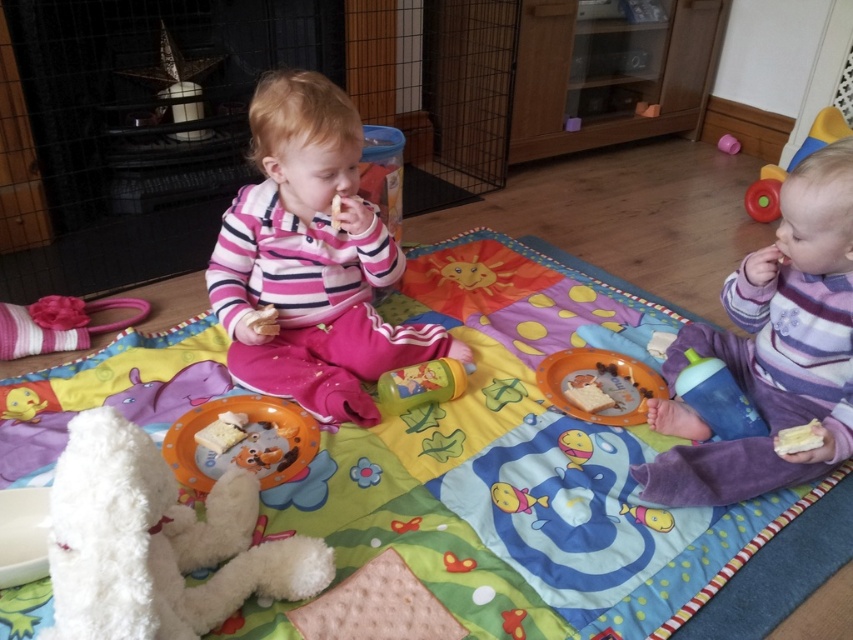
Does rubberized red ball at upper right have a greater width compared to matte pink cup at upper right?

Yes, rubberized red ball at upper right is wider than matte pink cup at upper right.

Is point (758, 180) positioned behind point (718, 138)?

That is False.

This screenshot has width=853, height=640. I want to click on rubberized red ball at upper right, so (x=792, y=164).

Is the position of pink fleece sweater at center more distant than that of translucent plastic sippy cup at center?

No, pink fleece sweater at center is in front of translucent plastic sippy cup at center.

Between point (283, 339) and point (448, 392), which one is positioned behind?

The point (283, 339) is more distant.

Image resolution: width=853 pixels, height=640 pixels. What do you see at coordinates (311, 259) in the screenshot?
I see `pink fleece sweater at center` at bounding box center [311, 259].

I want to click on pink fleece sweater at center, so click(x=311, y=259).

Which is below, pink fleece sweater at center or matte pink cup at upper right?

pink fleece sweater at center is below.

Between point (276, 276) and point (723, 144), which one is positioned in front?

Point (276, 276)

Image resolution: width=853 pixels, height=640 pixels. In order to click on pink fleece sweater at center in this screenshot , I will do `click(311, 259)`.